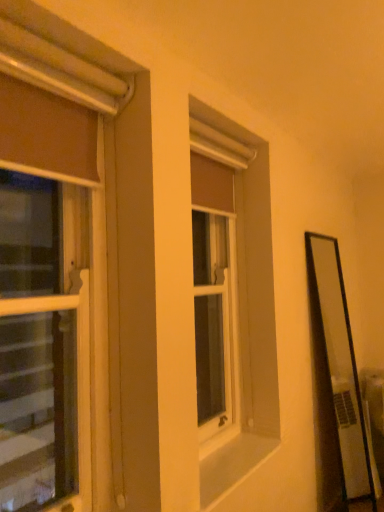
Question: Is matte brown curtain at left, marked as the first window in a front-to-back arrangement, a part of matte brown curtain at center, marked as the second window in a front-to-back arrangement?

Choices:
 (A) yes
 (B) no

Answer: (B)

Question: From the image's perspective, is matte brown curtain at center, the first window positioned from the back, located above matte brown curtain at left, which ranks as the second window in right-to-left order?

Choices:
 (A) yes
 (B) no

Answer: (B)

Question: Is matte brown curtain at center, the first window positioned from the back, closer to camera compared to matte brown curtain at left, which appears as the 1th window when viewed from the left?

Choices:
 (A) yes
 (B) no

Answer: (B)

Question: Is matte brown curtain at center, which ranks as the second window in left-to-right order, far away from matte brown curtain at left, marked as the first window in a front-to-back arrangement?

Choices:
 (A) no
 (B) yes

Answer: (A)

Question: Is matte brown curtain at center, which ranks as the second window in left-to-right order, shorter than matte brown curtain at left, which is counted as the 2th window, starting from the back?

Choices:
 (A) no
 (B) yes

Answer: (B)

Question: Is white smooth window sill at center inside or outside of matte brown curtain at center, which ranks as the second window in left-to-right order?

Choices:
 (A) inside
 (B) outside

Answer: (B)

Question: From the image's perspective, is white smooth window sill at center positioned above or below matte brown curtain at center, which ranks as the second window in left-to-right order?

Choices:
 (A) above
 (B) below

Answer: (B)

Question: Considering the positions of white smooth window sill at center and matte brown curtain at center, marked as the second window in a front-to-back arrangement, in the image, is white smooth window sill at center wider or thinner than matte brown curtain at center, marked as the second window in a front-to-back arrangement,?

Choices:
 (A) thin
 (B) wide

Answer: (B)

Question: Considering the positions of white smooth window sill at center and matte brown curtain at center, the first window positioned from the back, in the image, is white smooth window sill at center bigger or smaller than matte brown curtain at center, the first window positioned from the back,?

Choices:
 (A) small
 (B) big

Answer: (A)

Question: From a real-world perspective, is matte brown curtain at center, marked as the second window in a front-to-back arrangement, above or below matte brown curtain at left, which ranks as the second window in right-to-left order?

Choices:
 (A) below
 (B) above

Answer: (A)

Question: In the image, is matte brown curtain at center, the first window positioned from the back, positioned in front of or behind matte brown curtain at left, marked as the first window in a front-to-back arrangement?

Choices:
 (A) front
 (B) behind

Answer: (B)

Question: Is point (226, 371) closer or farther from the camera than point (127, 147)?

Choices:
 (A) closer
 (B) farther

Answer: (B)

Question: Based on their positions, is matte brown curtain at center, marked as the second window in a front-to-back arrangement, located to the left or right of matte brown curtain at left, which appears as the 1th window when viewed from the left?

Choices:
 (A) left
 (B) right

Answer: (B)

Question: Looking at the image, does matte brown curtain at left, which is counted as the 2th window, starting from the back, seem bigger or smaller compared to white smooth window sill at center?

Choices:
 (A) big
 (B) small

Answer: (A)

Question: From a real-world perspective, relative to white smooth window sill at center, is matte brown curtain at left, which is counted as the 2th window, starting from the back, vertically above or below?

Choices:
 (A) below
 (B) above

Answer: (B)